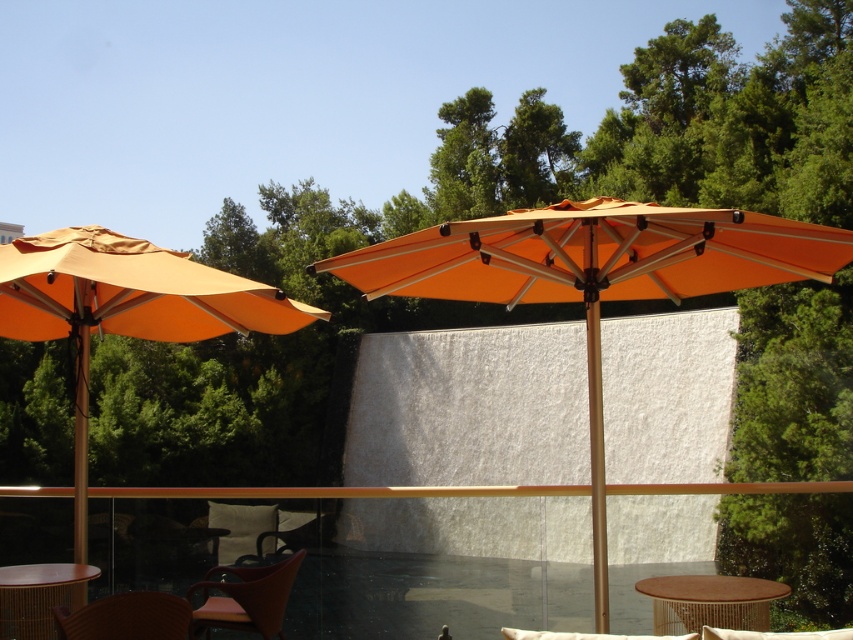
Between orange fabric umbrella at center and matte brown chair at lower left, which one is positioned lower?

matte brown chair at lower left

Between orange fabric umbrella at center and matte brown chair at lower left, which one is positioned higher?

orange fabric umbrella at center is higher up.

At what (x,y) coordinates should I click in order to perform the action: click on orange fabric umbrella at center. Please return your answer as a coordinate pair (x, y). The image size is (853, 640). Looking at the image, I should click on point(592,282).

Identify the location of orange fabric umbrella at center. (592, 282).

Which of these two, orange fabric umbrella at center or brown woven table at center, stands taller?

Standing taller between the two is orange fabric umbrella at center.

How distant is orange fabric umbrella at center from brown woven table at center?

30.29 inches

Is point (538, 266) farther from camera compared to point (660, 584)?

No, it is in front of (660, 584).

You are a GUI agent. You are given a task and a screenshot of the screen. Output one action in this format:
    pyautogui.click(x=<x>, y=<y>)
    Task: Click on the orange fabric umbrella at center
    The image size is (853, 640).
    Given the screenshot: What is the action you would take?
    pyautogui.click(x=592, y=282)

Can you confirm if wooden table at lower left is positioned above matte brown chair at lower left?

No, wooden table at lower left is not above matte brown chair at lower left.

Between point (91, 570) and point (137, 604), which one is positioned behind?

Positioned behind is point (91, 570).

Does point (0, 636) lie behind point (57, 618)?

Yes, point (0, 636) is farther from viewer.

You are a GUI agent. You are given a task and a screenshot of the screen. Output one action in this format:
    pyautogui.click(x=<x>, y=<y>)
    Task: Click on the wooden table at lower left
    This screenshot has width=853, height=640.
    Given the screenshot: What is the action you would take?
    pyautogui.click(x=39, y=596)